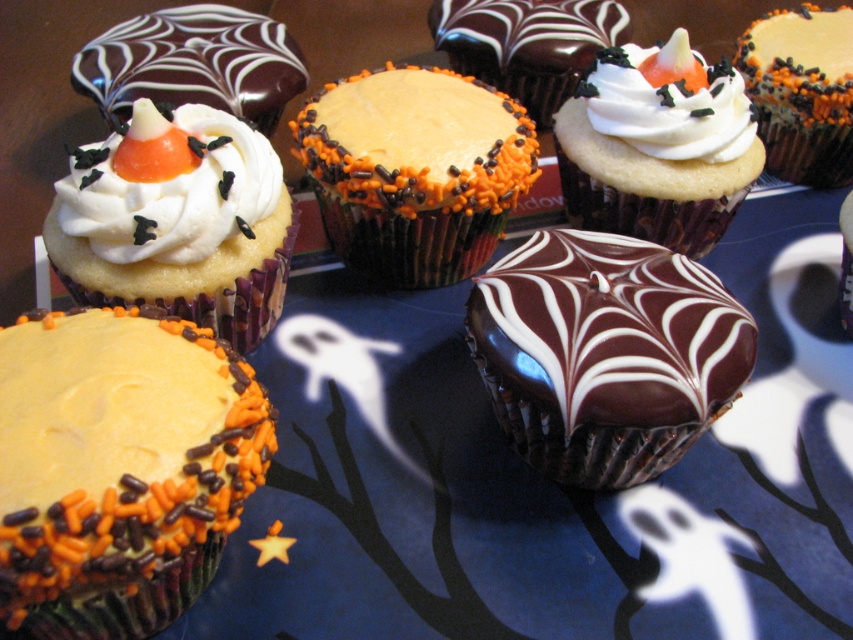
Can you confirm if chocolate glaze spiderweb cupcake at center is taller than white chocolate cupcake at upper right?

No.

Is chocolate glaze spiderweb cupcake at center further to camera compared to white chocolate cupcake at upper right?

No, it is in front of white chocolate cupcake at upper right.

Does point (184, 54) come behind point (821, 20)?

No, it is not.

Locate an element on the screen. chocolate glaze spiderweb cupcake at center is located at coordinates (193, 65).

Between point (163, 385) and point (563, 436), which one is positioned in front?

Point (163, 385) is more forward.

Can you confirm if orange sprinkled cupcake at center-left is positioned below chocolate swirled cupcake at center?

Correct, orange sprinkled cupcake at center-left is located below chocolate swirled cupcake at center.

The width and height of the screenshot is (853, 640). What do you see at coordinates (120, 468) in the screenshot? I see `orange sprinkled cupcake at center-left` at bounding box center [120, 468].

You are a GUI agent. You are given a task and a screenshot of the screen. Output one action in this format:
    pyautogui.click(x=<x>, y=<y>)
    Task: Click on the orange sprinkled cupcake at center-left
    
    Given the screenshot: What is the action you would take?
    pyautogui.click(x=120, y=468)

Who is taller, chocolate swirled cupcake at center or white fluffy frosting at upper right?

With more height is chocolate swirled cupcake at center.

Between point (728, 381) and point (634, 124), which one is positioned in front?

Point (728, 381) is more forward.

You are a GUI agent. You are given a task and a screenshot of the screen. Output one action in this format:
    pyautogui.click(x=<x>, y=<y>)
    Task: Click on the chocolate swirled cupcake at center
    The width and height of the screenshot is (853, 640).
    Given the screenshot: What is the action you would take?
    pyautogui.click(x=605, y=353)